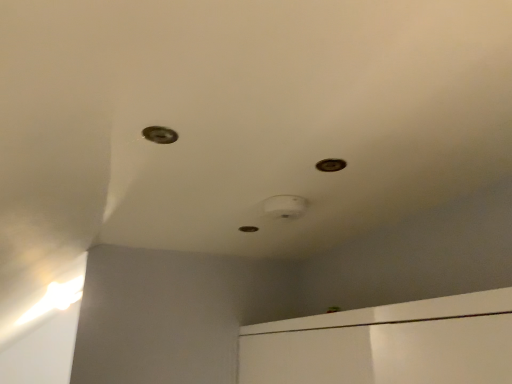
Question: Based on their sizes in the image, would you say metallic circular hole at upper center, which is the second hole from bottom to top, is bigger or smaller than metallic circular hole at upper left, the 3th hole in the back-to-front sequence?

Choices:
 (A) small
 (B) big

Answer: (A)

Question: Considering the positions of metallic circular hole at upper center, the second hole in the front-to-back sequence, and metallic circular hole at upper left, the 3th hole in the back-to-front sequence, in the image, is metallic circular hole at upper center, the second hole in the front-to-back sequence, wider or thinner than metallic circular hole at upper left, the 3th hole in the back-to-front sequence,?

Choices:
 (A) thin
 (B) wide

Answer: (A)

Question: Based on their relative distances, which object is farther from the metallic hole at center, which appears as the second hole when viewed from the left?

Choices:
 (A) metallic circular hole at upper center, which is the 3th hole in left-to-right order
 (B) metallic circular hole at upper left, arranged as the first hole when viewed from the top

Answer: (B)

Question: Which object is the closest to the metallic circular hole at upper left, the 3th hole in the bottom-to-top sequence?

Choices:
 (A) metallic hole at center, which appears as the second hole when viewed from the left
 (B) metallic circular hole at upper center, which is the 3th hole in left-to-right order

Answer: (B)